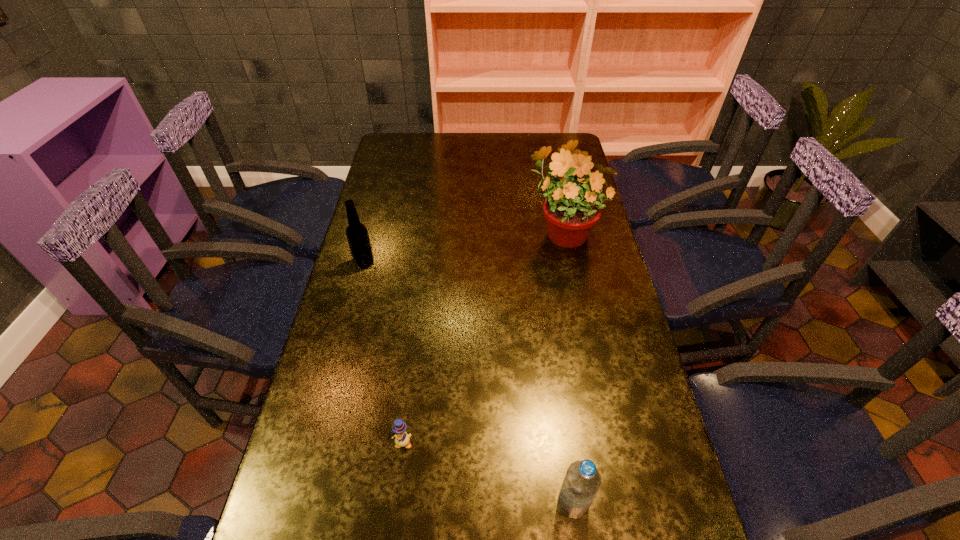
The height and width of the screenshot is (540, 960). Find the location of `flowerpot`. flowerpot is located at coordinates (571, 209).

I want to click on the tallest object, so click(x=571, y=209).

Locate an element on the screen. This screenshot has height=540, width=960. beer bottle is located at coordinates (357, 235).

Identify the location of the second tallest object. (357, 235).

Where is `the second shortest object`? This screenshot has height=540, width=960. the second shortest object is located at coordinates (582, 481).

Find the location of `the nearest object`. the nearest object is located at coordinates (582, 481).

Locate an element on the screen. the second nearest object is located at coordinates click(402, 439).

What are the coordinates of `duckling` in the screenshot? It's located at (402, 439).

You are a GUI agent. You are given a task and a screenshot of the screen. Output one action in this format:
    pyautogui.click(x=<x>, y=<y>)
    Task: Click on the free location located on the front of the farthest object
    Image resolution: width=960 pixels, height=540 pixels.
    Given the screenshot: What is the action you would take?
    pyautogui.click(x=580, y=315)

Image resolution: width=960 pixels, height=540 pixels. In order to click on vacant space located on the front of the leftmost object in this screenshot , I will do `click(348, 328)`.